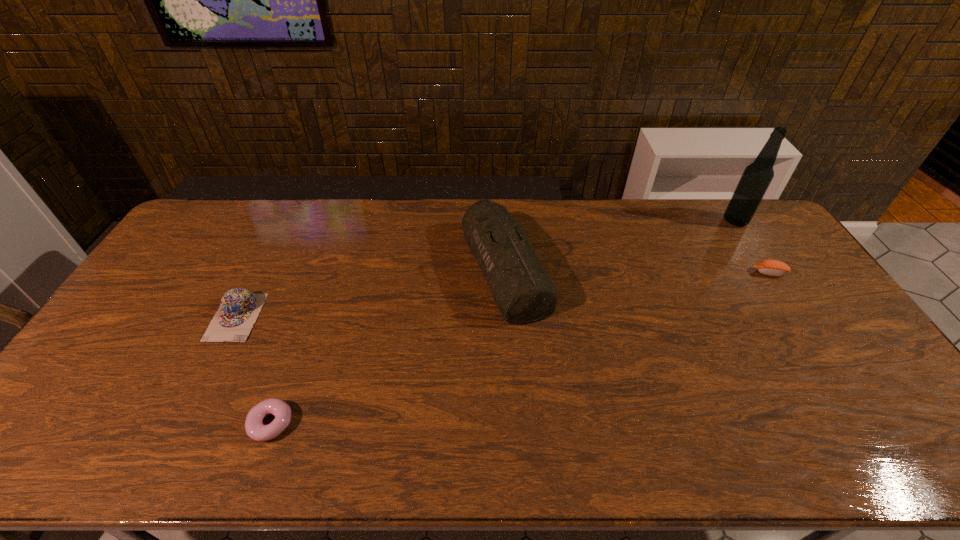
This screenshot has height=540, width=960. I want to click on vacant space in between the second tallest object and the third tallest object, so click(x=371, y=293).

What are the coordinates of `the fourth closest object to the sushi` in the screenshot? It's located at (239, 309).

The height and width of the screenshot is (540, 960). I want to click on the closest object relative to the leftmost object, so click(255, 429).

Identify the location of vacant space that satisfies the following two spatial constraints: 1. on the back side of the third object from right to left; 2. on the right side of the tallest object. This screenshot has height=540, width=960. (502, 221).

Locate an element on the screen. This screenshot has height=540, width=960. vacant point that satisfies the following two spatial constraints: 1. on the front, side, and top of the nearest object; 2. on the right side of the leftmost object is located at coordinates (182, 423).

Locate an element on the screen. The width and height of the screenshot is (960, 540). vacant region that satisfies the following two spatial constraints: 1. on the front, side, and top of the shortest object; 2. on the right side of the leftmost object is located at coordinates (182, 423).